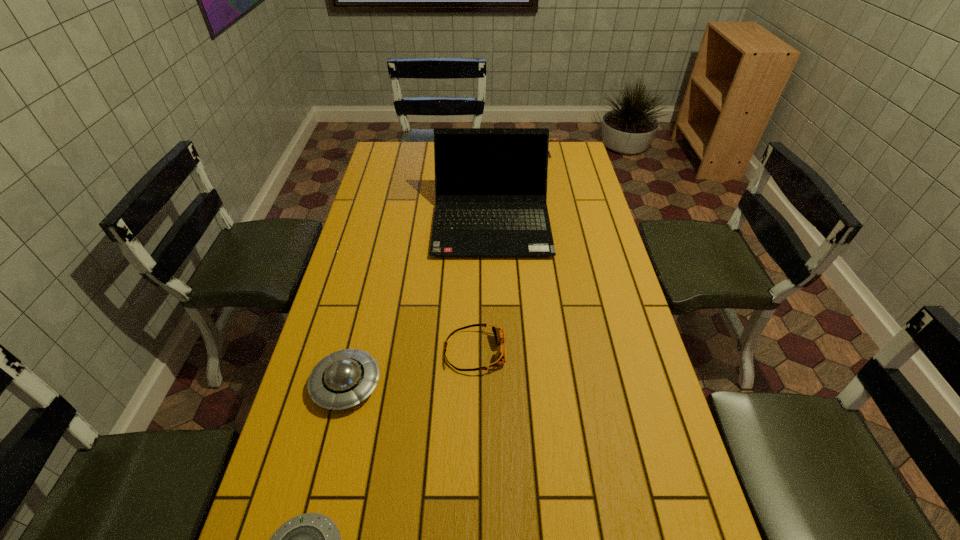
Where is `object that is the third nearest to the farthest object`? Image resolution: width=960 pixels, height=540 pixels. object that is the third nearest to the farthest object is located at coordinates (342, 379).

Where is `the second closest object to the third tallest object`? the second closest object to the third tallest object is located at coordinates (299, 539).

You are a GUI agent. You are given a task and a screenshot of the screen. Output one action in this format:
    pyautogui.click(x=<x>, y=<y>)
    Task: Click on the vacant space that satisfies the following two spatial constraints: 1. with the lenses facing forward on the fourth tallest object; 2. on the front side of the third tallest object
    The image size is (960, 540).
    Given the screenshot: What is the action you would take?
    pyautogui.click(x=474, y=384)